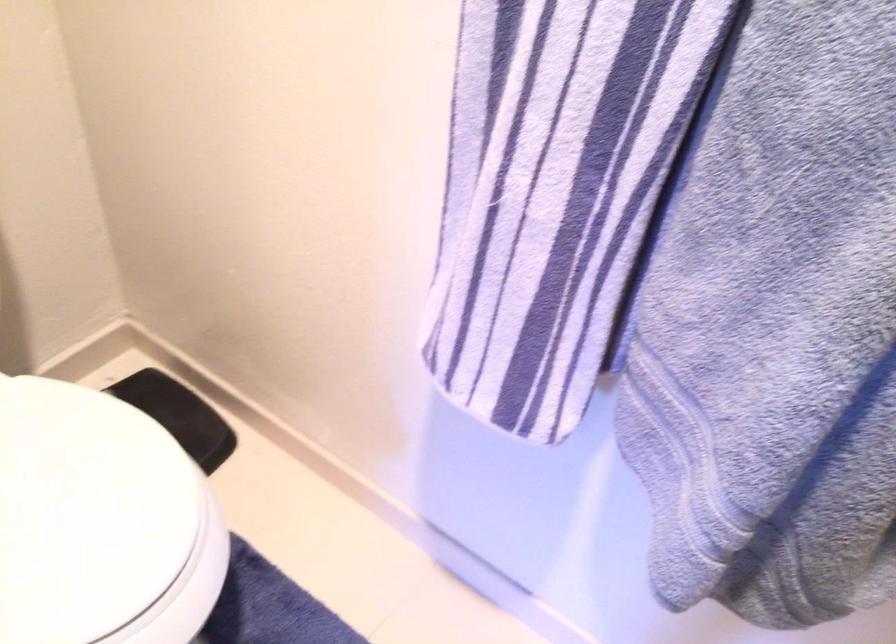
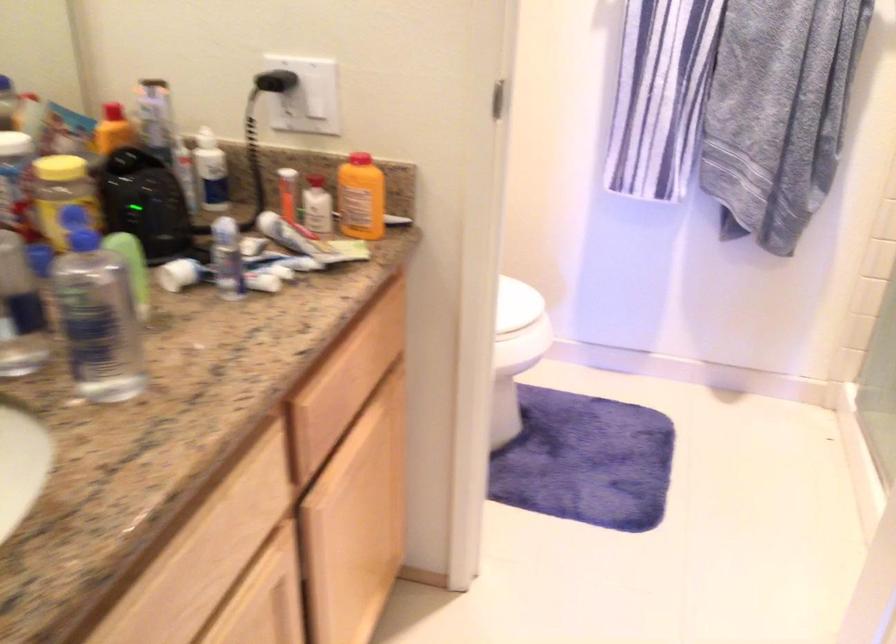
In a continuous first-person perspective shot, in which direction is the camera moving?

The cameraman moved toward left, backward.